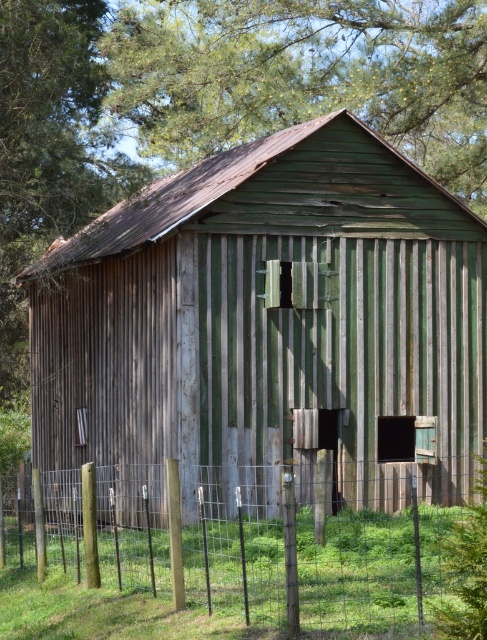
You are standing in a field and see the green corrugated metal barn at center and the metal wire fence at lower center. Which object is closer to you?

The metal wire fence at lower center is closer to you because it is positioned under the green corrugated metal barn at center.

You are standing in front of the old wooden shed. There is a point marked at coordinates [269,323]. Based on the scene description, where is this point located?

The point is located on the green corrugated metal barn at center.

Based on the photo, you are standing in front of the old wooden shed and want to walk towards the green corrugated metal barn at center and the metal wire fence at lower center. Which object will you encounter first?

The green corrugated metal barn at center is closer to you than the metal wire fence at lower center, so you will encounter the green corrugated metal barn at center first.